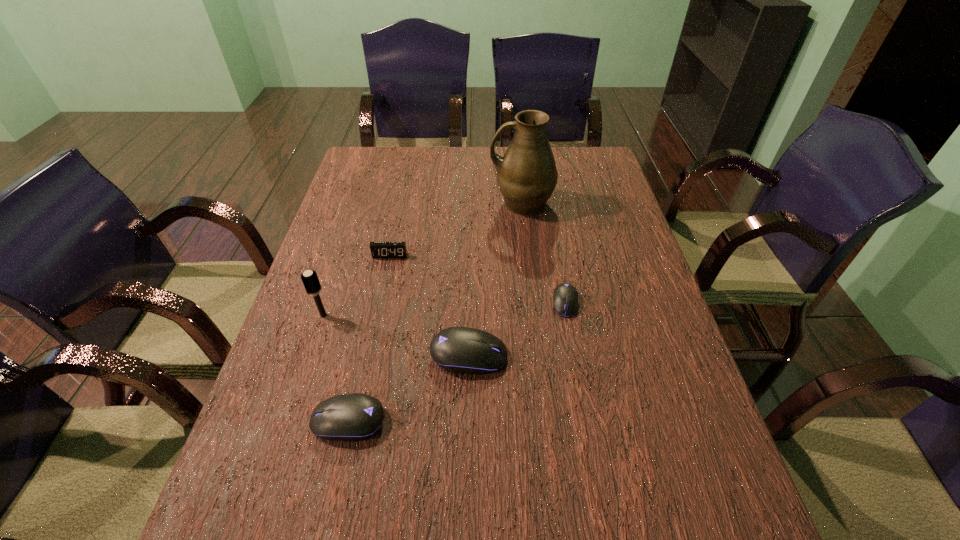
This screenshot has width=960, height=540. Find the location of `the second closest computer mouse to the fifth farthest object`. the second closest computer mouse to the fifth farthest object is located at coordinates (565, 298).

Find the location of a particular element. the third closest computer mouse relative to the second tallest object is located at coordinates (565, 298).

The image size is (960, 540). Find the location of `blank space that satisfies the following two spatial constraints: 1. on the back side of the leftmost computer mouse; 2. on the handle side of the tallest object`. blank space that satisfies the following two spatial constraints: 1. on the back side of the leftmost computer mouse; 2. on the handle side of the tallest object is located at coordinates (397, 204).

Where is `vacant space that satisfies the following two spatial constraints: 1. on the front side of the fifth farthest object; 2. on the left side of the leftmost object`? Image resolution: width=960 pixels, height=540 pixels. vacant space that satisfies the following two spatial constraints: 1. on the front side of the fifth farthest object; 2. on the left side of the leftmost object is located at coordinates (310, 355).

What are the coordinates of `vacant region that satisfies the following two spatial constraints: 1. on the back side of the second nearest computer mouse; 2. on the handle side of the pitcher` in the screenshot? It's located at (472, 204).

Identify the location of free location that satisfies the following two spatial constraints: 1. on the back side of the second computer mouse from left to right; 2. on the left side of the shortest computer mouse. The width and height of the screenshot is (960, 540). (470, 302).